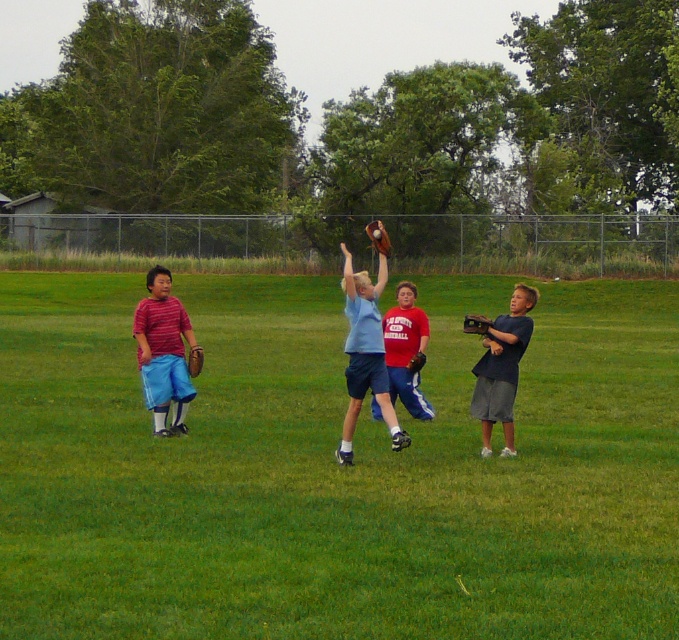
Question: Which object appears closest to the camera in this image?

Choices:
 (A) brown leather glove at center
 (B) light blue jersey at center
 (C) dark brown leather glove at center

Answer: (B)

Question: Does matte red shirt at left have a greater width compared to brown leather glove at center?

Choices:
 (A) no
 (B) yes

Answer: (A)

Question: In this image, where is light blue jersey at center located relative to dark blue jersey at right?

Choices:
 (A) below
 (B) above

Answer: (B)

Question: Is green grass field at center below dark blue jersey at right?

Choices:
 (A) no
 (B) yes

Answer: (A)

Question: Based on their relative distances, which object is nearer to the green grass field at center?

Choices:
 (A) brown leather glove at upper center
 (B) dark brown leather glove at center
 (C) light blue jersey at center

Answer: (A)

Question: Among these objects, which one is nearest to the camera?

Choices:
 (A) red matte shirt at center
 (B) brown leather glove at upper center
 (C) brown leather glove at center

Answer: (B)